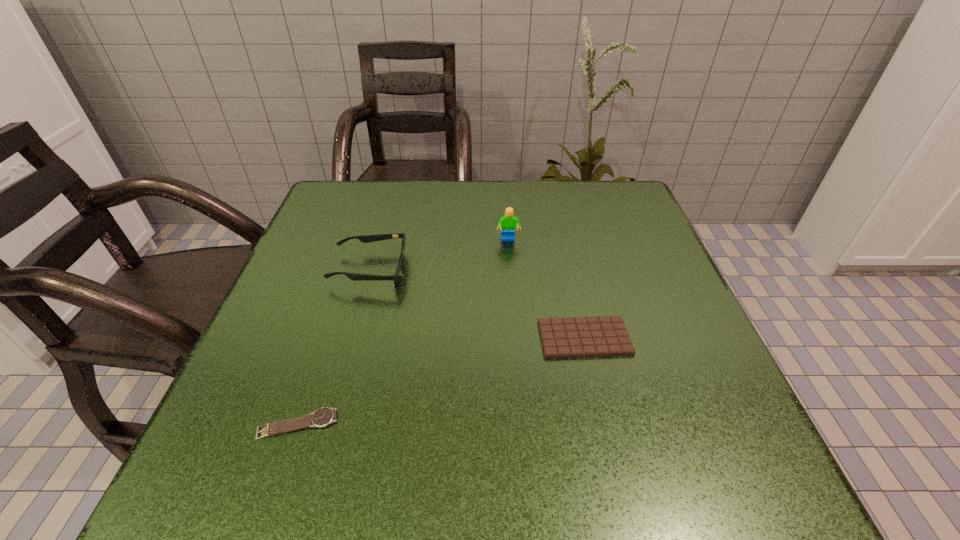
The height and width of the screenshot is (540, 960). Find the location of `free space located on the back of the chocolate bar`. free space located on the back of the chocolate bar is located at coordinates (561, 234).

Where is `vacant space located 0.220m on the right of the shortest object`? vacant space located 0.220m on the right of the shortest object is located at coordinates (481, 424).

Locate an element on the screen. object located in the near edge section of the desktop is located at coordinates (x=324, y=416).

I want to click on sunglasses positioned at the left edge, so click(x=378, y=237).

Find the location of a particular element. This screenshot has width=960, height=540. watch that is at the left edge is located at coordinates (324, 416).

You are a GUI agent. You are given a task and a screenshot of the screen. Output one action in this format:
    pyautogui.click(x=<x>, y=<y>)
    Task: Click on the object that is at the right edge
    This screenshot has width=960, height=540.
    Given the screenshot: What is the action you would take?
    pyautogui.click(x=566, y=337)

Locate an element on the screen. The height and width of the screenshot is (540, 960). object that is at the near left corner is located at coordinates (324, 416).

In the image, there is a desktop. Where is `vacant space at the far edge`? This screenshot has width=960, height=540. vacant space at the far edge is located at coordinates (560, 180).

Locate an element on the screen. This screenshot has width=960, height=540. vacant space at the near edge of the desktop is located at coordinates (491, 476).

This screenshot has height=540, width=960. I want to click on vacant space at the left edge of the desktop, so click(x=333, y=248).